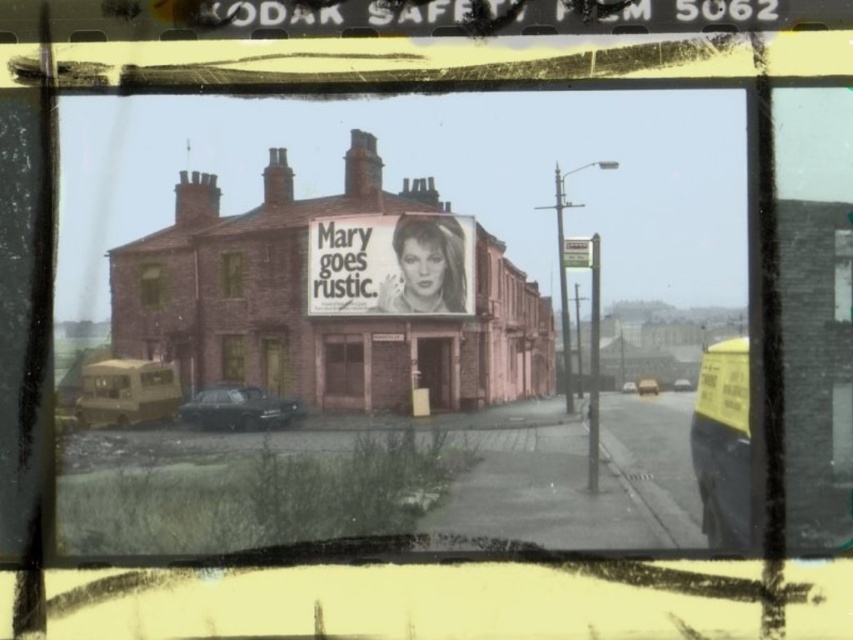
Is brick wall storefront at center to the right of black and white poster at center from the viewer's perspective?

No, brick wall storefront at center is not to the right of black and white poster at center.

Is brick wall storefront at center above black and white poster at center?

No.

Locate an element on the screen. The image size is (853, 640). brick wall storefront at center is located at coordinates (305, 301).

Between shiny black car at lower left and metallic silver car at center, which one has more height?

shiny black car at lower left

Between point (202, 422) and point (672, 387), which one is positioned behind?

The point (202, 422) is behind.

Where is `shiny black car at lower left`? shiny black car at lower left is located at coordinates (236, 408).

Can you confirm if white plastic sign at center is positioned to the left of metallic gold van at center?

Correct, you'll find white plastic sign at center to the left of metallic gold van at center.

Who is more distant from viewer, (582, 252) or (656, 385)?

A: The point (582, 252) is more distant.

I want to click on white plastic sign at center, so click(577, 252).